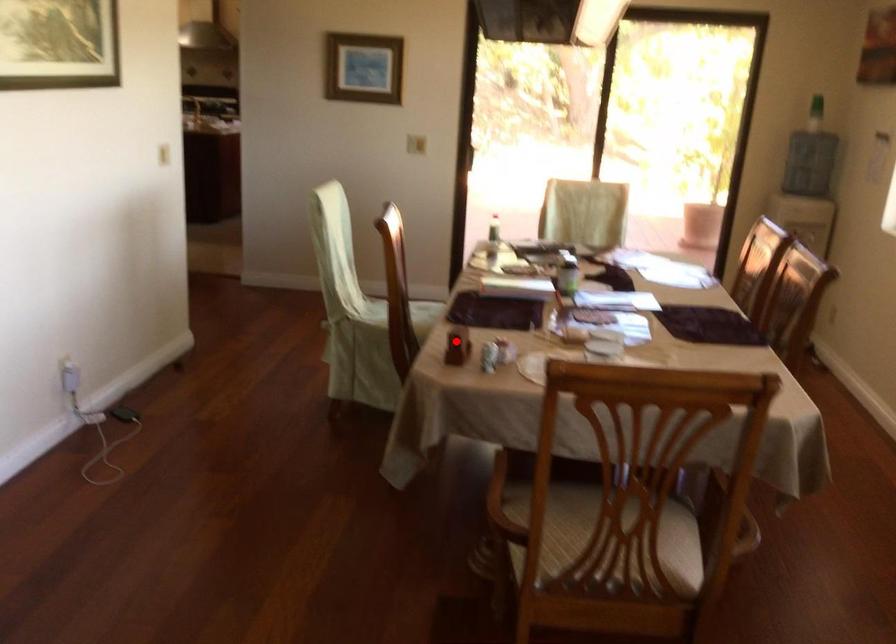
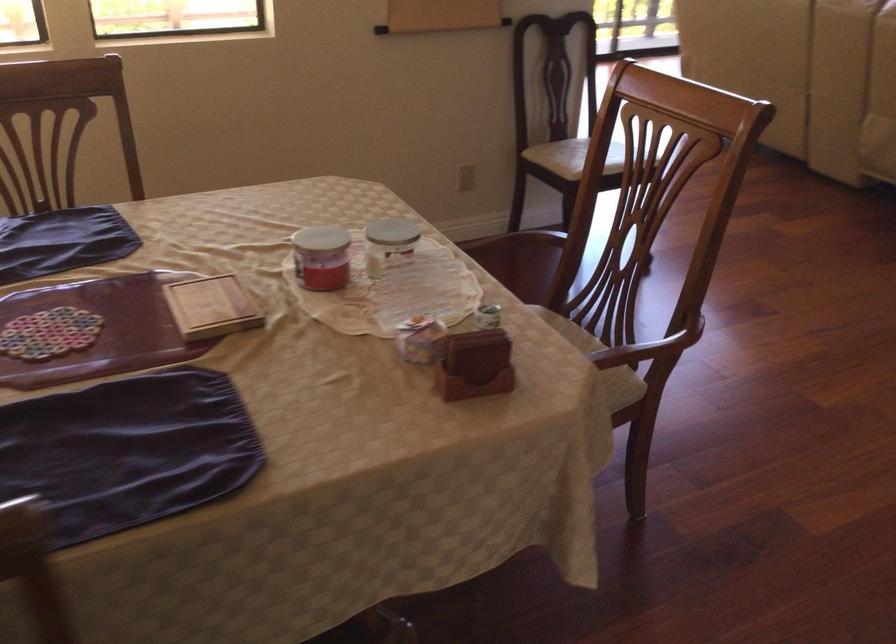
Where in the second image is the point corresponding to the highlighted location from the first image?

(475, 365)